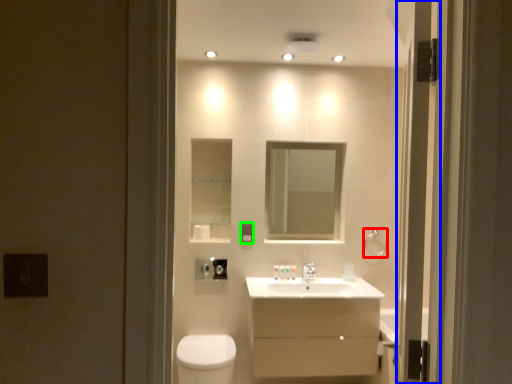
Question: Estimate the real-world distances between objects in this image. Which object is closer to towel bar (highlighted by a red box), screen door (highlighted by a blue box) or electric outlet (highlighted by a green box)?

Choices:
 (A) screen door
 (B) electric outlet

Answer: (B)